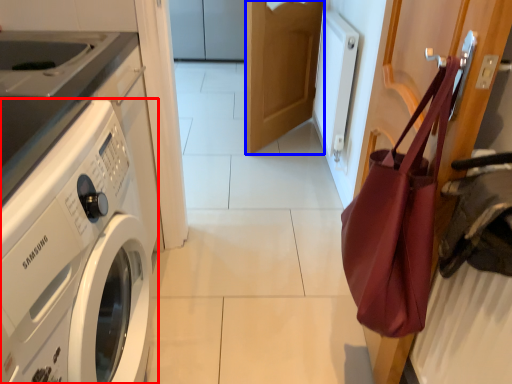
Question: Which point is closer to the camera, washing machine (highlighted by a red box) or door (highlighted by a blue box)?

Choices:
 (A) washing machine
 (B) door

Answer: (A)